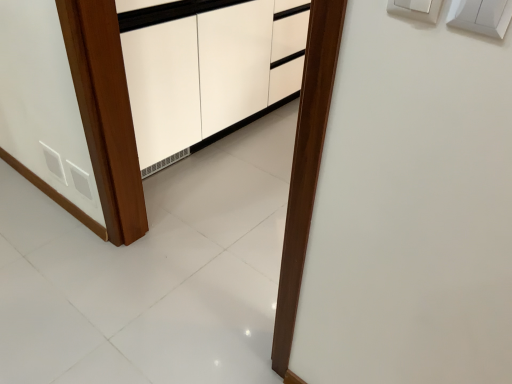
Measure the distance between white plastic switch at upper right and camera.

white plastic switch at upper right is 61.40 centimeters from camera.

The image size is (512, 384). I want to click on white plastic switch at upper right, so click(x=416, y=9).

The width and height of the screenshot is (512, 384). Describe the element at coordinates (416, 9) in the screenshot. I see `white plastic switch at upper right` at that location.

Where is `white plastic light switch at upper right`? white plastic light switch at upper right is located at coordinates (481, 16).

What do you see at coordinates (481, 16) in the screenshot? This screenshot has width=512, height=384. I see `white plastic light switch at upper right` at bounding box center [481, 16].

Locate an element on the screen. white plastic switch at upper right is located at coordinates (416, 9).

Considering the relative positions of white plastic light switch at upper right and white plastic switch at upper right in the image provided, is white plastic light switch at upper right to the right of white plastic switch at upper right from the viewer's perspective?

Yes, white plastic light switch at upper right is to the right of white plastic switch at upper right.

Which object is further away from the camera taking this photo, white plastic light switch at upper right or white plastic switch at upper right?

white plastic switch at upper right.

Is point (462, 27) closer or farther from the camera than point (421, 12)?

Clearly, point (462, 27) is closer to the camera than point (421, 12).

From the image's perspective, is white plastic light switch at upper right located beneath white plastic switch at upper right?

Indeed, from the image's perspective, white plastic light switch at upper right is shown beneath white plastic switch at upper right.

In the scene shown: From a real-world perspective, is white plastic light switch at upper right above or below white plastic switch at upper right?

Clearly, from a real-world perspective, white plastic light switch at upper right is below white plastic switch at upper right.

Based on the photo, between white plastic light switch at upper right and white plastic switch at upper right, which one has smaller width?

white plastic switch at upper right.

Can you confirm if white plastic light switch at upper right is taller than white plastic switch at upper right?

No, white plastic light switch at upper right is not taller than white plastic switch at upper right.

Is white plastic light switch at upper right bigger than white plastic switch at upper right?

No, white plastic light switch at upper right is not bigger than white plastic switch at upper right.

Could white plastic switch at upper right be considered to be inside white plastic light switch at upper right?

Definitely not — white plastic switch at upper right is not inside white plastic light switch at upper right.

Would you consider white plastic light switch at upper right to be distant from white plastic switch at upper right?

No, there isn't a large distance between white plastic light switch at upper right and white plastic switch at upper right.

Consider the image. Is white plastic light switch at upper right oriented away from white plastic switch at upper right?

No, white plastic light switch at upper right is not facing away from white plastic switch at upper right.

How many degrees apart are the facing directions of white plastic light switch at upper right and white plastic switch at upper right?

There is a 0.0104-degree angle between the facing directions of white plastic light switch at upper right and white plastic switch at upper right.

Locate an element on the screen. light switch on the right of white plastic switch at upper right is located at coordinates (481, 16).

Between white plastic switch at upper right and white plastic light switch at upper right, which one appears on the right side from the viewer's perspective?

white plastic light switch at upper right is more to the right.

Is white plastic switch at upper right further to camera compared to white plastic light switch at upper right?

Yes, the depth of white plastic switch at upper right is greater than that of white plastic light switch at upper right.

Does point (396, 9) come closer to viewer compared to point (480, 32)?

No, (396, 9) is further to viewer.

From the image's perspective, which one is positioned lower, white plastic switch at upper right or white plastic light switch at upper right?

From the image's view, white plastic light switch at upper right is below.

From a real-world perspective, is white plastic switch at upper right below white plastic light switch at upper right?

Incorrect, from a real-world perspective, white plastic switch at upper right is higher than white plastic light switch at upper right.

In terms of width, does white plastic switch at upper right look wider or thinner when compared to white plastic light switch at upper right?

Considering their sizes, white plastic switch at upper right looks slimmer than white plastic light switch at upper right.

Considering the relative sizes of white plastic switch at upper right and white plastic light switch at upper right in the image provided, is white plastic switch at upper right shorter than white plastic light switch at upper right?

Incorrect, the height of white plastic switch at upper right does not fall short of that of white plastic light switch at upper right.

From the picture: Considering the relative sizes of white plastic switch at upper right and white plastic light switch at upper right in the image provided, is white plastic switch at upper right smaller than white plastic light switch at upper right?

No.

Could white plastic light switch at upper right be considered to be inside white plastic switch at upper right?

No, white plastic light switch at upper right is located outside of white plastic switch at upper right.

Is there a large distance between white plastic switch at upper right and white plastic light switch at upper right?

white plastic switch at upper right is near white plastic light switch at upper right, not far away.

Could you tell me if white plastic switch at upper right is turned towards white plastic light switch at upper right?

No, white plastic switch at upper right does not turn towards white plastic light switch at upper right.

What's the angular difference between white plastic switch at upper right and white plastic light switch at upper right's facing directions?

The facing directions of white plastic switch at upper right and white plastic light switch at upper right are 0.0104 degrees apart.

Find the location of a particular element. electric outlet that appears above the white plastic light switch at upper right (from a real-world perspective) is located at coordinates (416, 9).

Identify the location of electric outlet that appears above the white plastic light switch at upper right (from the image's perspective). (416, 9).

Identify the location of light switch in front of the white plastic switch at upper right. This screenshot has width=512, height=384. (481, 16).